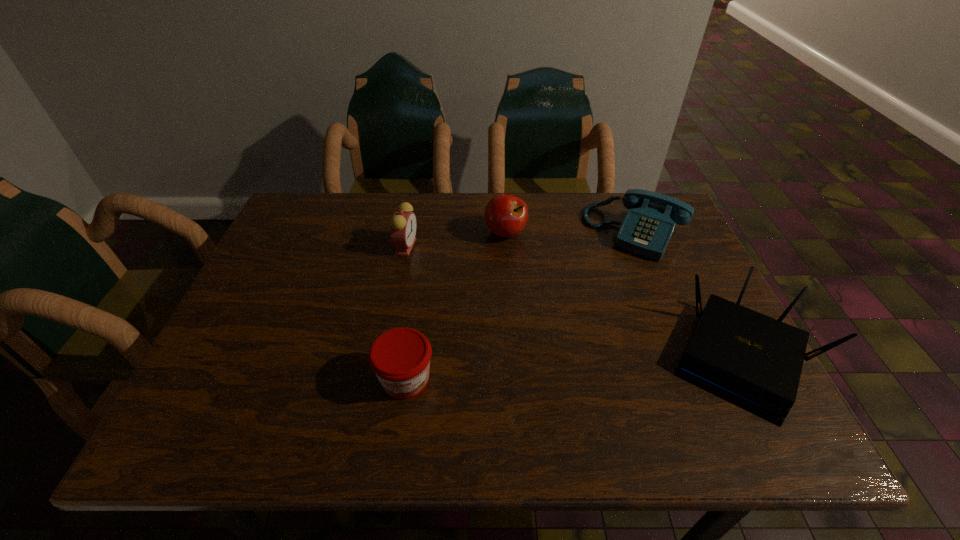
Locate an element on the screen. The height and width of the screenshot is (540, 960). object that is the closest to the telephone is located at coordinates (753, 361).

Where is `free location that satisfies the following two spatial constraints: 1. on the back side of the apple; 2. on the right side of the alarm clock`? The image size is (960, 540). free location that satisfies the following two spatial constraints: 1. on the back side of the apple; 2. on the right side of the alarm clock is located at coordinates (408, 233).